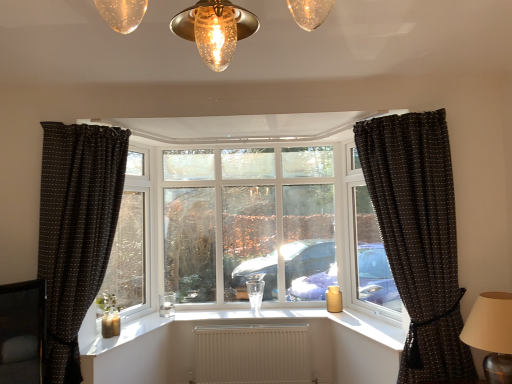
Question: Are clear glass window at center and matte brown table lamp at right far apart?

Choices:
 (A) no
 (B) yes

Answer: (B)

Question: Considering the relative positions of clear glass window at center and matte brown table lamp at right in the image provided, is clear glass window at center to the left of matte brown table lamp at right from the viewer's perspective?

Choices:
 (A) yes
 (B) no

Answer: (A)

Question: Is clear glass window at center taller than matte brown table lamp at right?

Choices:
 (A) no
 (B) yes

Answer: (B)

Question: Does clear glass window at center come behind matte brown table lamp at right?

Choices:
 (A) yes
 (B) no

Answer: (A)

Question: Is clear glass window at center surrounding matte brown table lamp at right?

Choices:
 (A) yes
 (B) no

Answer: (B)

Question: Can you confirm if clear glass window at center is bigger than matte brown table lamp at right?

Choices:
 (A) yes
 (B) no

Answer: (A)

Question: Could you tell me if black dotted fabric curtain at left, the first curtain in the left-to-right sequence, is facing clear glass window at right, the first window frame from the right?

Choices:
 (A) no
 (B) yes

Answer: (A)

Question: Can you confirm if black dotted fabric curtain at left, the first curtain in the left-to-right sequence, is positioned to the right of clear glass window at right, the first window frame from the right?

Choices:
 (A) yes
 (B) no

Answer: (B)

Question: From a real-world perspective, is black dotted fabric curtain at left, the first curtain in the left-to-right sequence, on clear glass window at right, the 2th window frame in the left-to-right sequence?

Choices:
 (A) no
 (B) yes

Answer: (A)

Question: Is black dotted fabric curtain at left, the second curtain viewed from the right, at the left side of clear glass window at right, the first window frame from the right?

Choices:
 (A) no
 (B) yes

Answer: (B)

Question: Is black dotted fabric curtain at left, the second curtain viewed from the right, oriented away from clear glass window at right, the first window frame from the right?

Choices:
 (A) yes
 (B) no

Answer: (B)

Question: Can we say black dotted fabric curtain at left, the first curtain in the left-to-right sequence, lies outside clear glass window at right, the 2th window frame in the left-to-right sequence?

Choices:
 (A) yes
 (B) no

Answer: (A)

Question: Does clear glass window at right, the 2th window frame in the left-to-right sequence, lie behind white textured radiator at center?

Choices:
 (A) no
 (B) yes

Answer: (A)